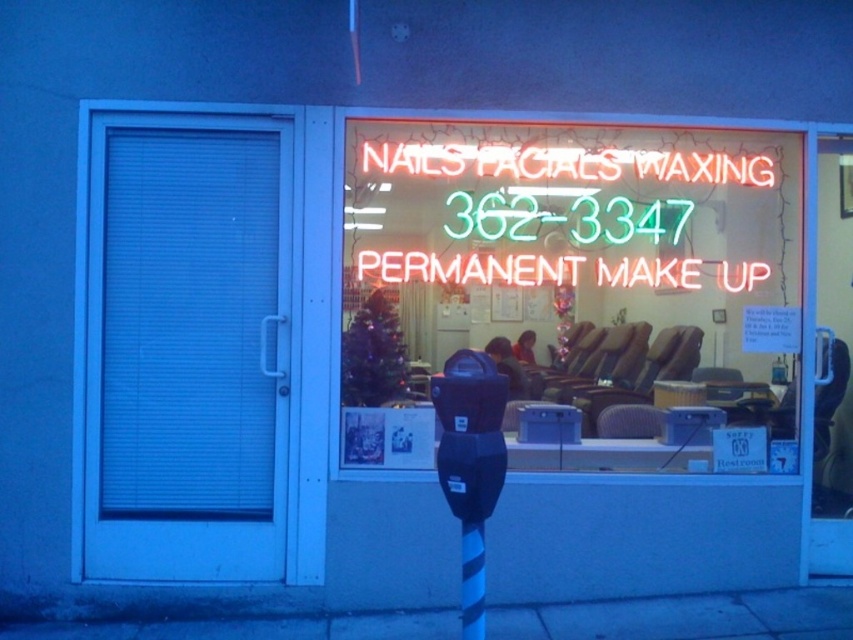
You are a delivery person who needs to park your bike between the neon sign at upper center and the black plastic parking meter at lower center. The bike requires 5 feet of space. Is there enough space?

The neon sign at upper center and black plastic parking meter at lower center are 4.53 feet apart, so there is not enough space to park the bike between them as it requires 5 feet.

You are standing in front of the beauty salon and want to locate the neon sign. Which object from the list contains the point at coordinate (566, 189)?

The point at coordinate (566, 189) is on the neontexturedsign at center.